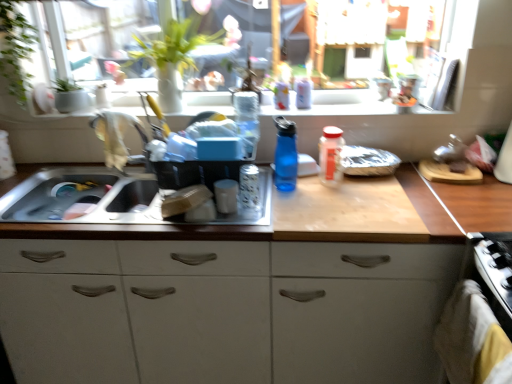
Where is `unoccupied region to the right of translucent plastic bottle at center, the 1th bottle when ordered from right to left`? unoccupied region to the right of translucent plastic bottle at center, the 1th bottle when ordered from right to left is located at coordinates (383, 186).